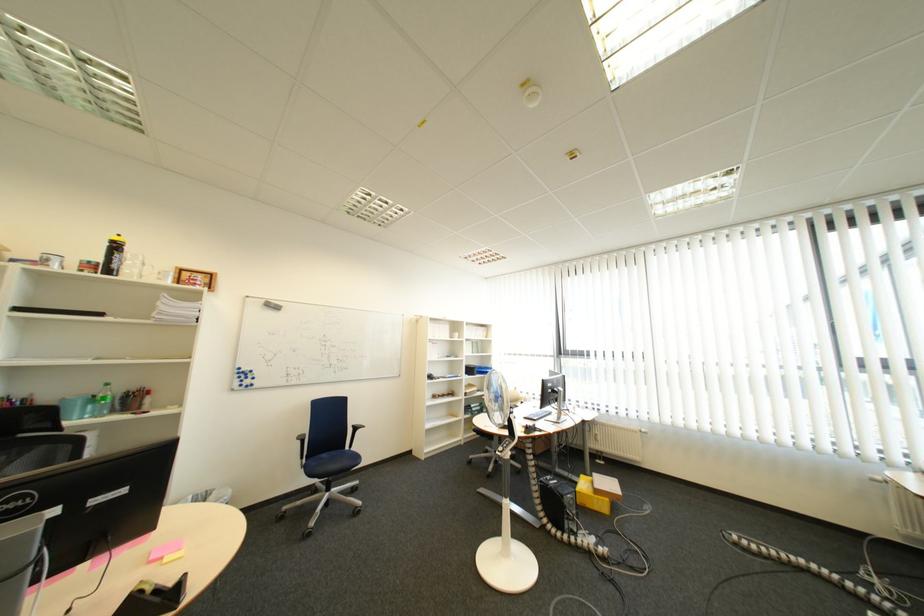
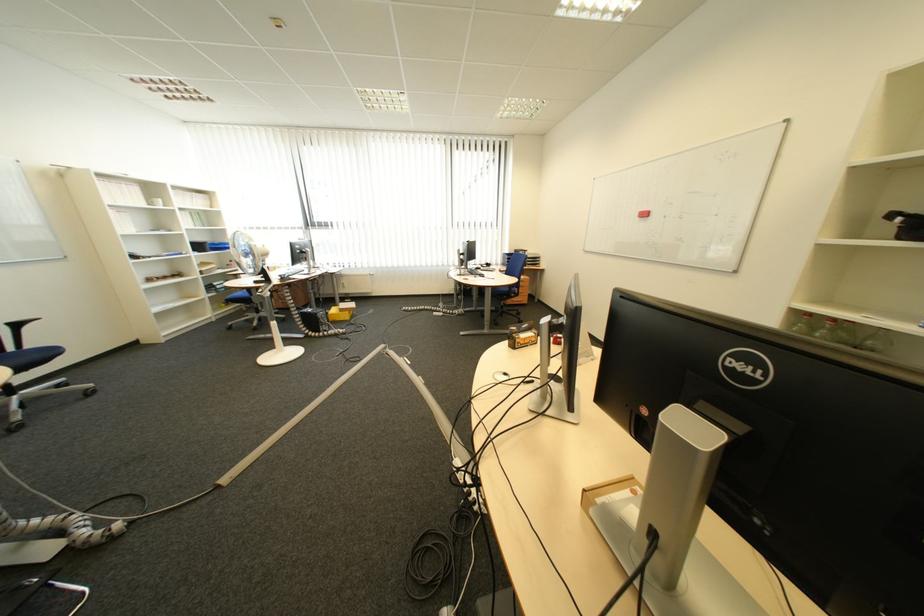
Find the pixel in the second image that matches point (363, 423) in the first image.

(13, 321)